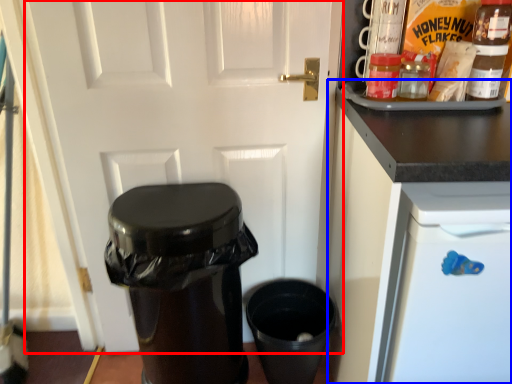
Question: Among these objects, which one is nearest to the camera, door (highlighted by a red box) or cabinetry (highlighted by a blue box)?

Choices:
 (A) door
 (B) cabinetry

Answer: (B)